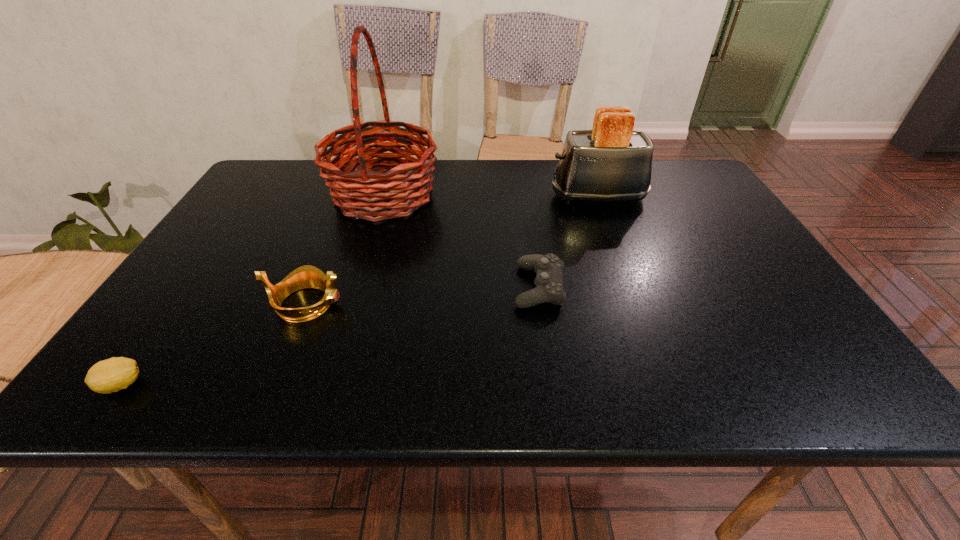
The width and height of the screenshot is (960, 540). In order to click on basket in this screenshot , I will do `click(399, 185)`.

This screenshot has height=540, width=960. Find the location of `the second tallest object`. the second tallest object is located at coordinates (612, 162).

Identify the location of toaster. The width and height of the screenshot is (960, 540). (612, 162).

Identify the location of tiara. Image resolution: width=960 pixels, height=540 pixels. (307, 276).

This screenshot has width=960, height=540. I want to click on control, so click(x=549, y=268).

You are a GUI agent. You are given a task and a screenshot of the screen. Output one action in this format:
    pyautogui.click(x=<x>, y=<y>)
    Task: Click on the nearest object
    The width and height of the screenshot is (960, 540).
    Given the screenshot: What is the action you would take?
    pos(111,375)

You are a GUI agent. You are given a task and a screenshot of the screen. Output one action in this format:
    pyautogui.click(x=<x>, y=<y>)
    Task: Click on the lemon
    The image size is (960, 540).
    Given the screenshot: What is the action you would take?
    pyautogui.click(x=111, y=375)

This screenshot has height=540, width=960. I want to click on vacant space located 0.290m on the handle side of the tallest object, so click(x=540, y=195).

You are a GUI agent. You are given a task and a screenshot of the screen. Output one action in this format:
    pyautogui.click(x=<x>, y=<y>)
    Task: Click on the free spot located 0.220m on the side of the rightmost object with the control lever
    The width and height of the screenshot is (960, 540).
    Given the screenshot: What is the action you would take?
    pyautogui.click(x=475, y=197)

The image size is (960, 540). Identify the location of vacant position located on the side of the rightmost object with the control lever. (451, 197).